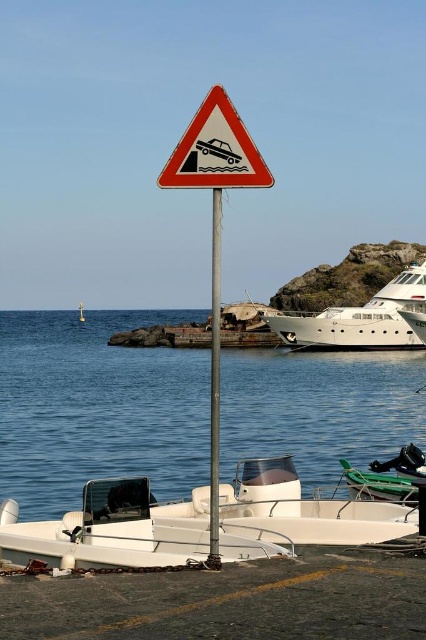
You are a tour guide giving a safety briefing to visitors near the coast. You point to the white matte boat at lower center and the white glossy yacht at right. Which boat is positioned closer to the left side of the scene?

The white matte boat at lower center is positioned to the left of the white glossy yacht at right, so it is closer to the left side of the scene.

You are standing at the coastal scene and want to take a photo of the triangular warning sign. You notice two points marked on your camera screen at coordinates point [224,536] and point [215,540]. Which point is closer to the camera?

Point [215,540] is closer to the camera because it is less further than point [224,536] according to the description.